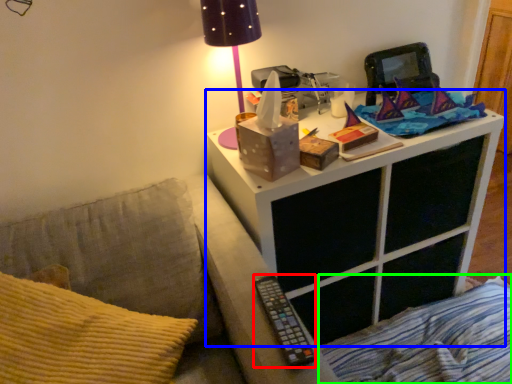
Question: Considering the real-world distances, which object is closest to remote (highlighted by a red box)? nightstand (highlighted by a blue box) or bedding (highlighted by a green box).

Choices:
 (A) nightstand
 (B) bedding

Answer: (A)